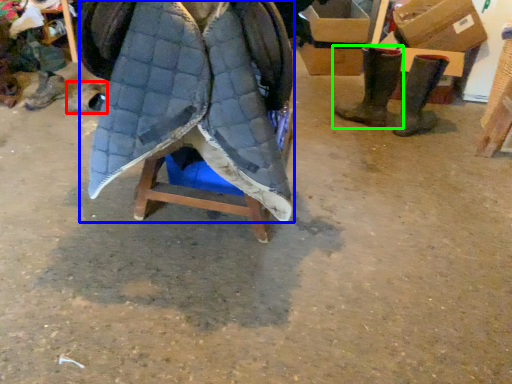
Question: Which is farther away from footwear (highlighted by a red box)? cloak (highlighted by a blue box) or footwear (highlighted by a green box)?

Choices:
 (A) cloak
 (B) footwear

Answer: (B)